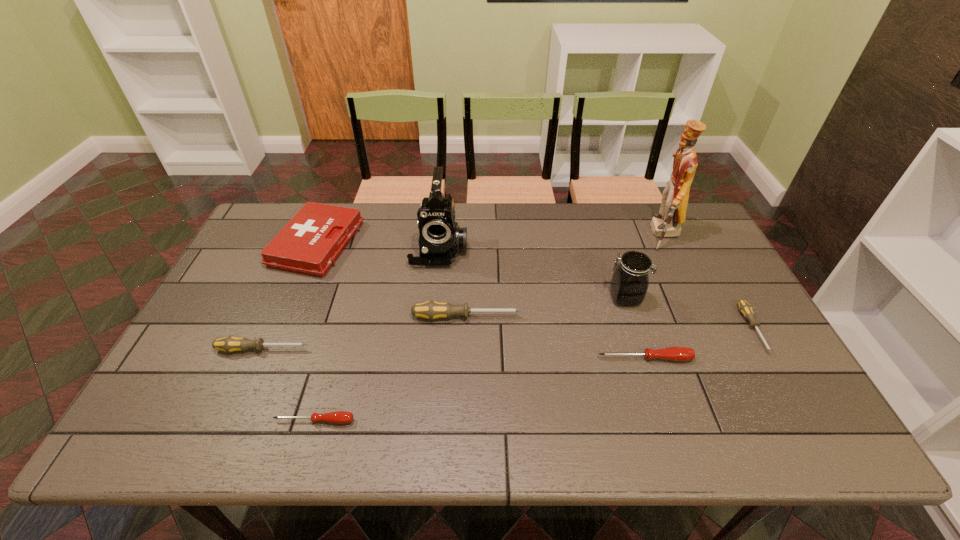
Where is `vacant space that satisfies the following two spatial constraints: 1. on the back side of the right red screwdriver; 2. at the tip of the tallest screwdriver`? vacant space that satisfies the following two spatial constraints: 1. on the back side of the right red screwdriver; 2. at the tip of the tallest screwdriver is located at coordinates (632, 317).

Where is `vacant region that satisfies the following two spatial constraints: 1. on the front side of the bigger red screwdriver; 2. on the left side of the red first-aid kit`? vacant region that satisfies the following two spatial constraints: 1. on the front side of the bigger red screwdriver; 2. on the left side of the red first-aid kit is located at coordinates (270, 359).

Where is `free space in the image that satisfies the following two spatial constraints: 1. at the tip of the smallest gray screwdriver; 2. at the tip of the second biggest gray screwdriver`? free space in the image that satisfies the following two spatial constraints: 1. at the tip of the smallest gray screwdriver; 2. at the tip of the second biggest gray screwdriver is located at coordinates coord(764,349).